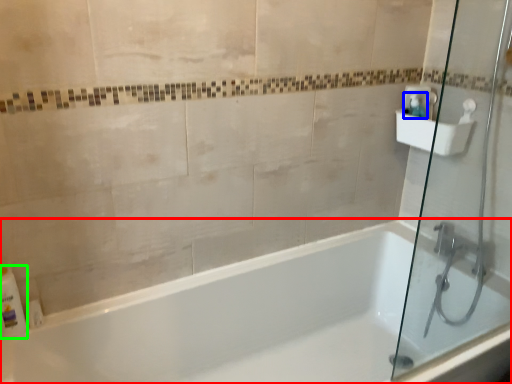
Question: Considering the real-world distances, which object is closest to bathtub (highlighted by a red box)? soap dispenser (highlighted by a blue box) or toiletry (highlighted by a green box).

Choices:
 (A) soap dispenser
 (B) toiletry

Answer: (B)